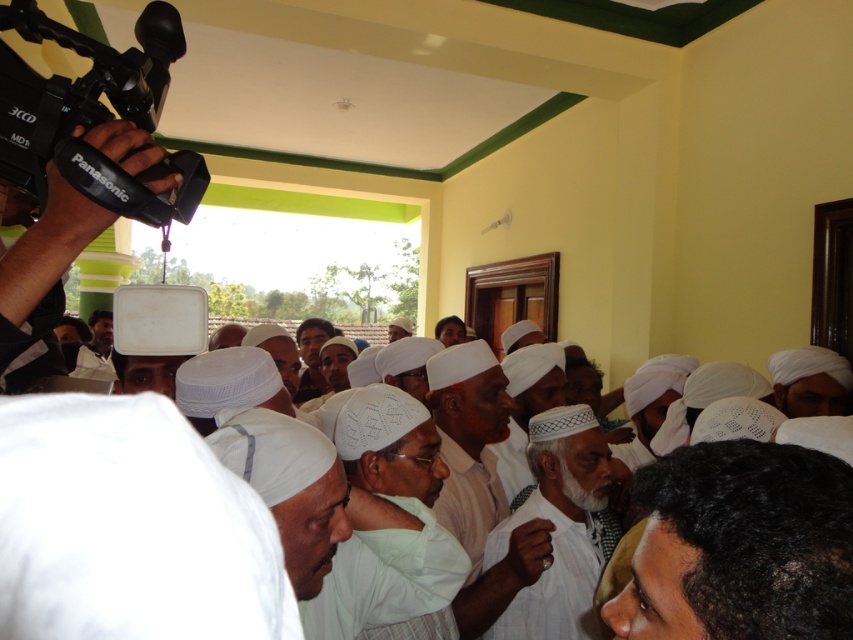
Question: Estimate the real-world distances between objects in this image. Which object is farther from the white cotton turban at center?

Choices:
 (A) white woven cloth at center
 (B) black plastic video camera at upper left

Answer: (B)

Question: Can you confirm if white matte turban at center is thinner than white cotton turban at center?

Choices:
 (A) no
 (B) yes

Answer: (A)

Question: Where is black plastic video camera at upper left located in relation to white matte turban at center in the image?

Choices:
 (A) right
 (B) left

Answer: (B)

Question: Which point is closer to the camera taking this photo?

Choices:
 (A) (463, 340)
 (B) (26, 76)
 (C) (494, 621)

Answer: (B)

Question: Which point appears closest to the camera in this image?

Choices:
 (A) (534, 445)
 (B) (42, 182)

Answer: (B)

Question: Does black matte hair at lower right appear over white matte turban at center?

Choices:
 (A) no
 (B) yes

Answer: (B)